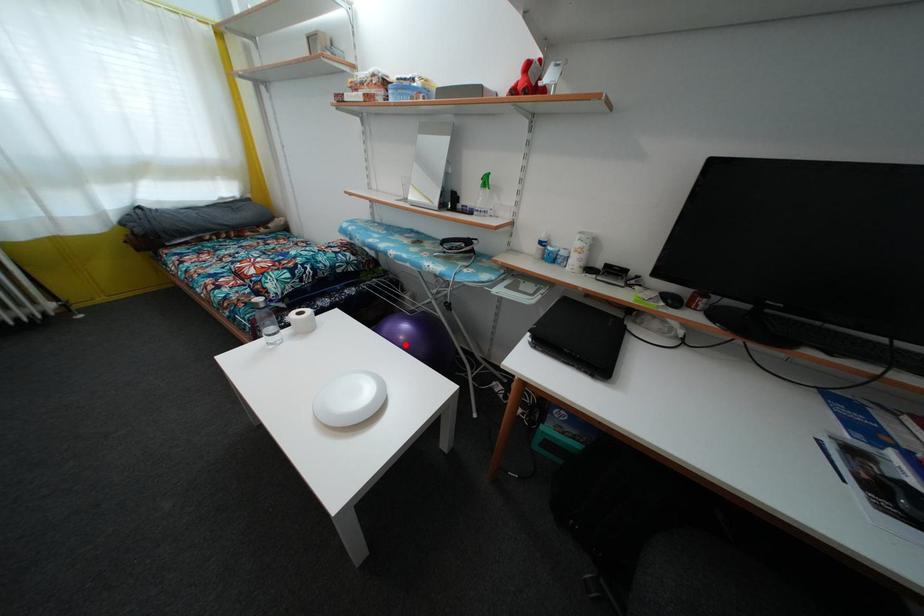
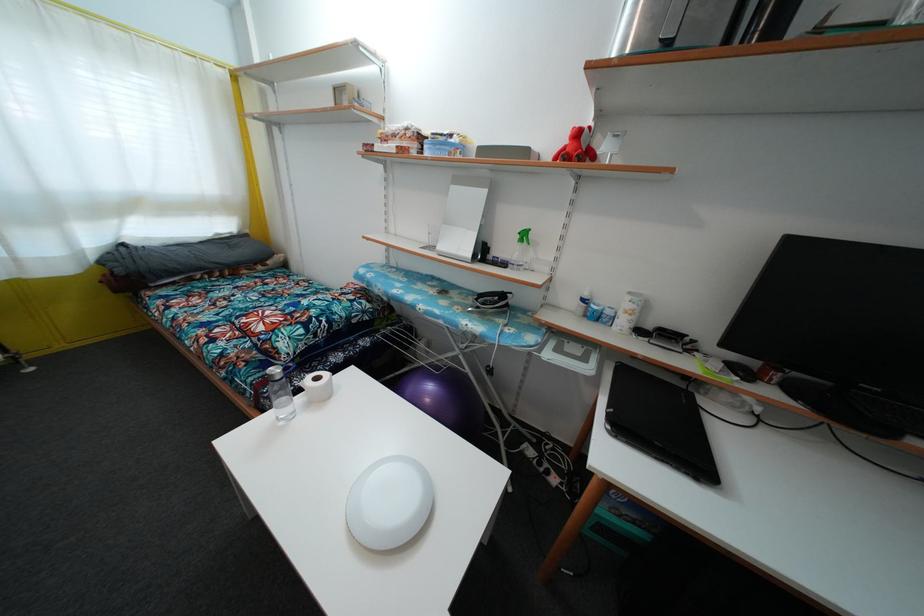
In the second image, find the point that corresponds to the highlighted location in the first image.

(431, 407)